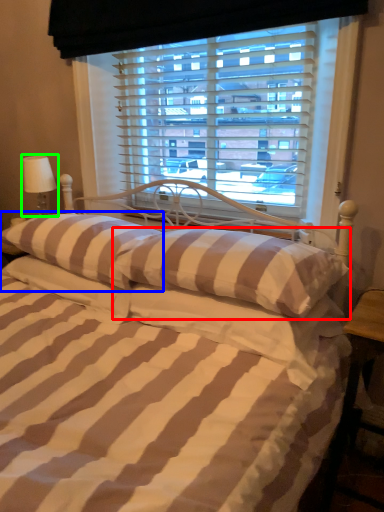
Question: Which object is the farthest from pillow (highlighted by a red box)? Choose among these: pillow (highlighted by a blue box) or table lamp (highlighted by a green box).

Choices:
 (A) pillow
 (B) table lamp

Answer: (B)